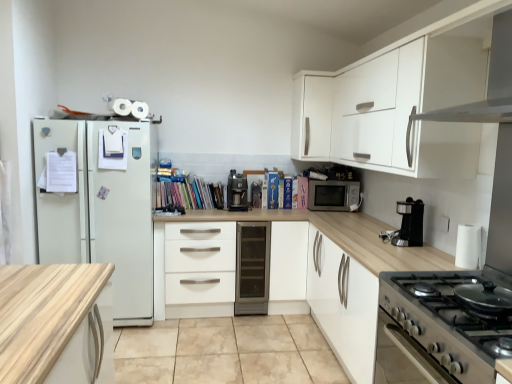
Question: Does white matte cabinet at upper right have a smaller size compared to white glossy exhaust hood at upper right?

Choices:
 (A) no
 (B) yes

Answer: (A)

Question: Does white matte cabinet at upper right have a lesser height compared to white glossy exhaust hood at upper right?

Choices:
 (A) yes
 (B) no

Answer: (B)

Question: Does white matte cabinet at upper right lie behind white glossy exhaust hood at upper right?

Choices:
 (A) no
 (B) yes

Answer: (B)

Question: Does white matte cabinet at upper right have a greater width compared to white glossy exhaust hood at upper right?

Choices:
 (A) yes
 (B) no

Answer: (B)

Question: Is white matte cabinet at upper right positioned in front of white glossy exhaust hood at upper right?

Choices:
 (A) no
 (B) yes

Answer: (A)

Question: From a real-world perspective, is white matte cabinet at upper right positioned under white glossy exhaust hood at upper right based on gravity?

Choices:
 (A) yes
 (B) no

Answer: (A)

Question: From the image's perspective, is stainless steel gas stove at lower right beneath satin silver wine cooler at center?

Choices:
 (A) no
 (B) yes

Answer: (A)

Question: Can you confirm if stainless steel gas stove at lower right is thinner than satin silver wine cooler at center?

Choices:
 (A) yes
 (B) no

Answer: (B)

Question: Considering the relative positions of stainless steel gas stove at lower right and satin silver wine cooler at center in the image provided, is stainless steel gas stove at lower right to the left of satin silver wine cooler at center from the viewer's perspective?

Choices:
 (A) yes
 (B) no

Answer: (B)

Question: Considering the relative sizes of stainless steel gas stove at lower right and satin silver wine cooler at center in the image provided, is stainless steel gas stove at lower right wider than satin silver wine cooler at center?

Choices:
 (A) yes
 (B) no

Answer: (A)

Question: Is stainless steel gas stove at lower right facing away from satin silver wine cooler at center?

Choices:
 (A) no
 (B) yes

Answer: (A)

Question: Is stainless steel gas stove at lower right completely or partially outside of satin silver wine cooler at center?

Choices:
 (A) yes
 (B) no

Answer: (A)

Question: Can you confirm if satin silver wine cooler at center is thinner than satin silver microwave at center?

Choices:
 (A) no
 (B) yes

Answer: (A)